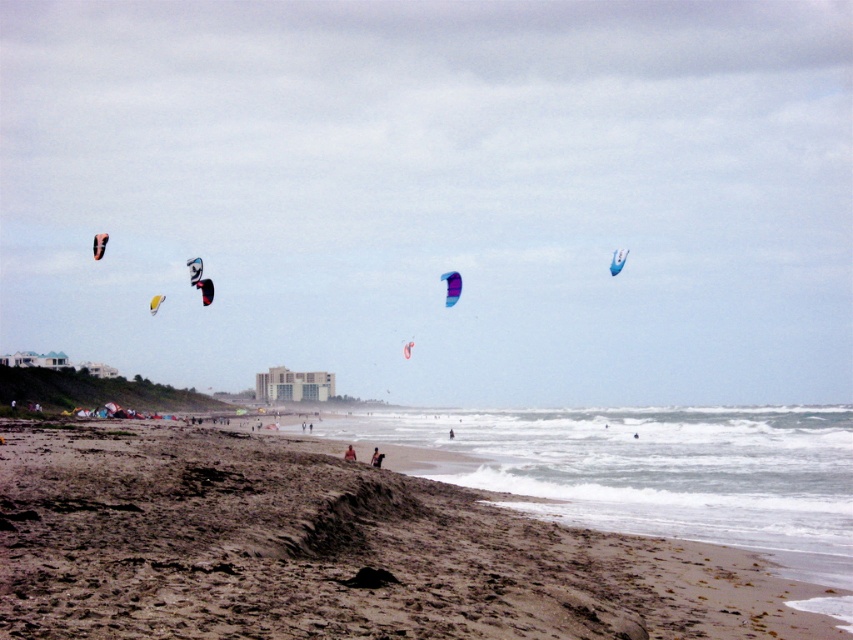
Can you confirm if purple matte parachute at center is wider than translucent purple kite at center?

Yes, purple matte parachute at center is wider than translucent purple kite at center.

Which is in front, point (445, 285) or point (409, 346)?

Point (445, 285) is more forward.

Between point (450, 275) and point (405, 348), which one is positioned in front?

Point (405, 348)

What are the coordinates of `purple matte parachute at center` in the screenshot? It's located at (451, 285).

The height and width of the screenshot is (640, 853). Describe the element at coordinates (99, 244) in the screenshot. I see `matte black parachute at upper left` at that location.

The width and height of the screenshot is (853, 640). I want to click on matte black parachute at upper left, so click(x=99, y=244).

At what (x,y) coordinates should I click in order to perform the action: click on matte black parachute at upper left. Please return your answer as a coordinate pair (x, y). This screenshot has height=640, width=853. Looking at the image, I should click on (99, 244).

Between yellow fabric parachute at upper center and translucent purple kite at center, which one has less height?

translucent purple kite at center

The width and height of the screenshot is (853, 640). I want to click on yellow fabric parachute at upper center, so [155, 301].

The height and width of the screenshot is (640, 853). Describe the element at coordinates (155, 301) in the screenshot. I see `yellow fabric parachute at upper center` at that location.

Identify the location of yellow fabric parachute at upper center. (155, 301).